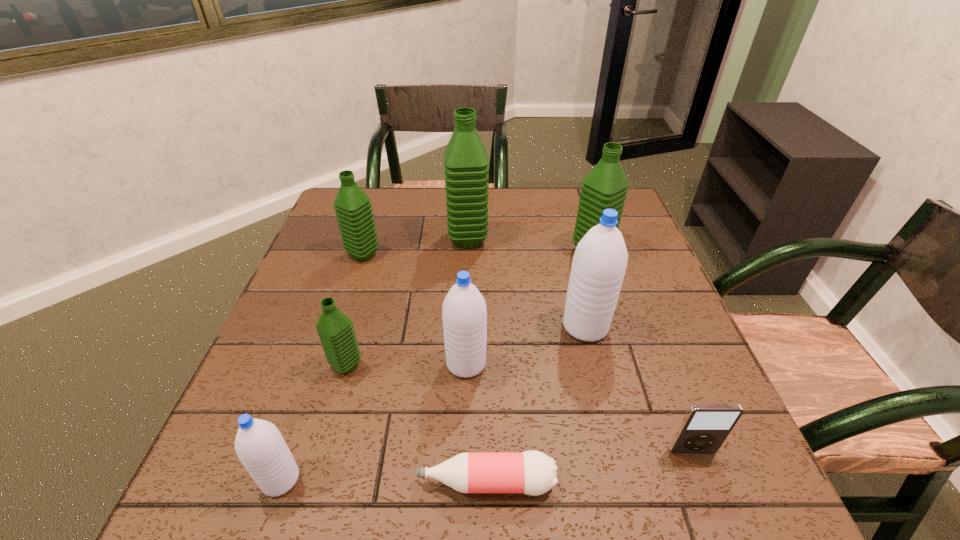
The width and height of the screenshot is (960, 540). What are the coordinates of `iPod present at the right edge` in the screenshot? It's located at (705, 427).

The width and height of the screenshot is (960, 540). I want to click on object present at the near left corner, so click(x=260, y=447).

Locate an element on the screen. The width and height of the screenshot is (960, 540). vacant space at the far edge of the desktop is located at coordinates (569, 190).

The width and height of the screenshot is (960, 540). In the image, there is a desktop. Find the location of `free space at the near edge`. free space at the near edge is located at coordinates (433, 497).

The width and height of the screenshot is (960, 540). In order to click on free space at the left edge of the desktop in this screenshot , I will do `click(303, 264)`.

The height and width of the screenshot is (540, 960). I want to click on free space at the right edge, so click(658, 364).

Find the location of a particular element. Image resolution: width=960 pixels, height=540 pixels. vacant space at the near right corner of the desktop is located at coordinates (690, 486).

I want to click on vacant region between the second smallest green water bottle and the nearest green water bottle, so click(355, 310).

You are a GUI agent. You are given a task and a screenshot of the screen. Output one action in this format:
    pyautogui.click(x=<x>, y=<y>)
    Task: Click on the free space between the nearest water bottle and the third biggest green water bottle
    Image resolution: width=960 pixels, height=540 pixels.
    Given the screenshot: What is the action you would take?
    pyautogui.click(x=322, y=367)

Locate an element on the screen. vacant area that lies between the farthest blue water bottle and the tallest object is located at coordinates (527, 283).